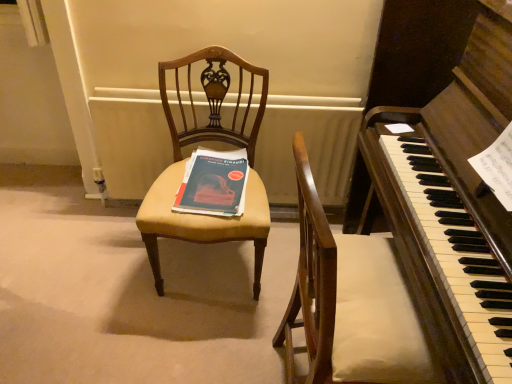
Question: Does matte blue paper at center have a lesser height compared to white painted radiator at center?

Choices:
 (A) no
 (B) yes

Answer: (B)

Question: Is matte blue paper at center turned away from white painted radiator at center?

Choices:
 (A) yes
 (B) no

Answer: (A)

Question: Is white painted radiator at center completely or partially inside matte blue paper at center?

Choices:
 (A) no
 (B) yes

Answer: (A)

Question: Can you confirm if matte blue paper at center is bigger than white painted radiator at center?

Choices:
 (A) no
 (B) yes

Answer: (A)

Question: Considering the relative sizes of matte blue paper at center and white painted radiator at center in the image provided, is matte blue paper at center taller than white painted radiator at center?

Choices:
 (A) yes
 (B) no

Answer: (B)

Question: Looking at the image, does dark brown polished wood harpsichord at center seem bigger or smaller compared to matte blue paper at center?

Choices:
 (A) small
 (B) big

Answer: (B)

Question: Is dark brown polished wood harpsichord at center in front of or behind matte blue paper at center in the image?

Choices:
 (A) behind
 (B) front

Answer: (B)

Question: Does point (397, 145) appear closer or farther from the camera than point (224, 178)?

Choices:
 (A) farther
 (B) closer

Answer: (B)

Question: From the image's perspective, is dark brown polished wood harpsichord at center positioned above or below matte blue paper at center?

Choices:
 (A) above
 (B) below

Answer: (B)

Question: Considering the positions of dark brown polished wood harpsichord at center and white painted radiator at center in the image, is dark brown polished wood harpsichord at center taller or shorter than white painted radiator at center?

Choices:
 (A) short
 (B) tall

Answer: (B)

Question: From the image's perspective, is dark brown polished wood harpsichord at center positioned above or below white painted radiator at center?

Choices:
 (A) above
 (B) below

Answer: (B)

Question: Considering their positions, is dark brown polished wood harpsichord at center located in front of or behind white painted radiator at center?

Choices:
 (A) front
 (B) behind

Answer: (A)

Question: Considering the positions of dark brown polished wood harpsichord at center and white painted radiator at center in the image, is dark brown polished wood harpsichord at center bigger or smaller than white painted radiator at center?

Choices:
 (A) small
 (B) big

Answer: (B)

Question: Based on their sizes in the image, would you say matte blue paper at center is bigger or smaller than matte yellow fabric chair at center?

Choices:
 (A) big
 (B) small

Answer: (B)

Question: From the image's perspective, relative to matte yellow fabric chair at center, is matte blue paper at center above or below?

Choices:
 (A) below
 (B) above

Answer: (B)